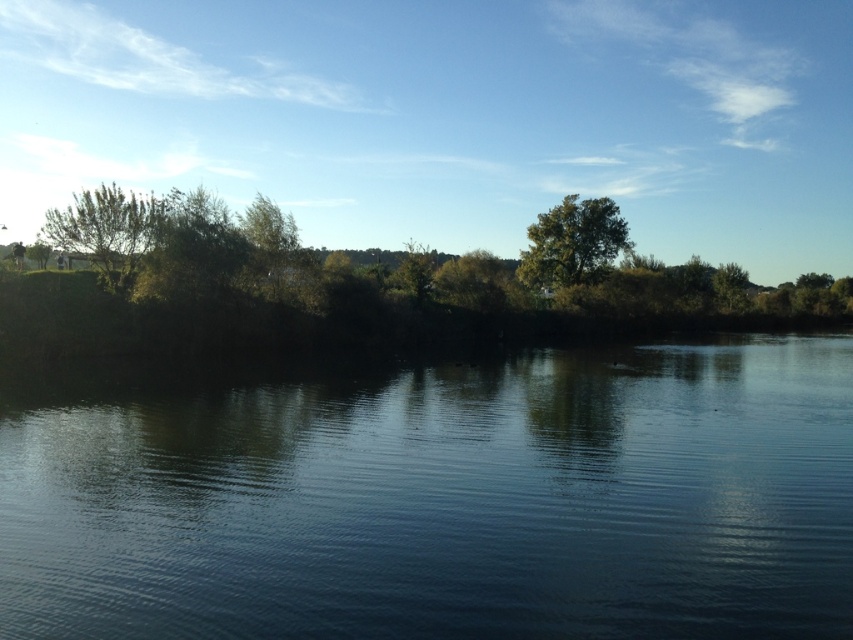
Who is more distant from viewer, (53,554) or (554,209)?

The point (554,209) is more distant.

Between dark blue water at center and green leafy tree at center, which one has more height?

green leafy tree at center

Image resolution: width=853 pixels, height=640 pixels. Describe the element at coordinates (433, 496) in the screenshot. I see `dark blue water at center` at that location.

Image resolution: width=853 pixels, height=640 pixels. I want to click on dark blue water at center, so click(x=433, y=496).

Based on the photo, is green leafy tree at left taller than green leafy tree at center?

Yes, green leafy tree at left is taller than green leafy tree at center.

Who is more forward, (x=103, y=189) or (x=595, y=211)?

Point (x=103, y=189)

The height and width of the screenshot is (640, 853). Describe the element at coordinates (109, 228) in the screenshot. I see `green leafy tree at left` at that location.

The width and height of the screenshot is (853, 640). I want to click on green leafy tree at left, so click(x=109, y=228).

Does dark blue water at center have a greater height compared to green leafy tree at left?

In fact, dark blue water at center may be shorter than green leafy tree at left.

Who is more distant from viewer, (688,534) or (125,250)?

The point (125,250) is behind.

Locate an element on the screen. dark blue water at center is located at coordinates (433, 496).

Where is `dark blue water at center`? The height and width of the screenshot is (640, 853). dark blue water at center is located at coordinates (433, 496).